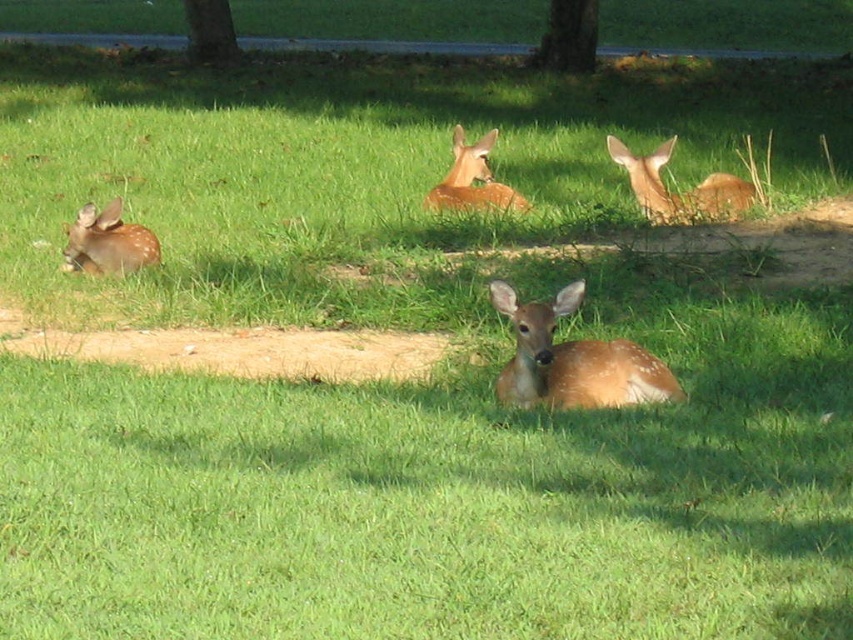
You are a photographer trying to capture the brown speckled fur at upper right and the fawn fur deer at left in a single shot. Which deer will appear closer to the camera in the photo?

The brown speckled fur at upper right will appear closer to the camera because it is positioned over the fawn fur deer at left.

You are a photographer trying to capture the brown speckled fur at upper right and the green rough bark tree at upper center in the same frame. Based on their sizes, which one should you zoom out to include first?

The brown speckled fur at upper right is wider than the green rough bark tree at upper center, so you should zoom out to include the brown speckled fur at upper right first.